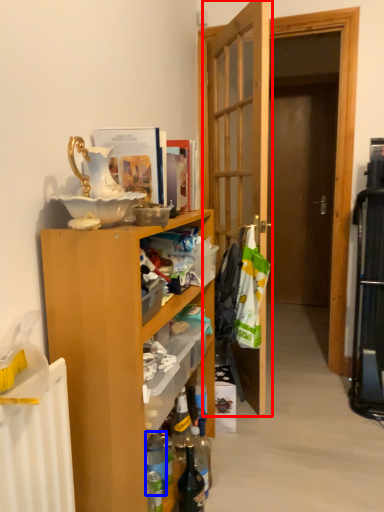
Question: Which object is further to the camera taking this photo, door (highlighted by a red box) or bottle (highlighted by a blue box)?

Choices:
 (A) door
 (B) bottle

Answer: (A)